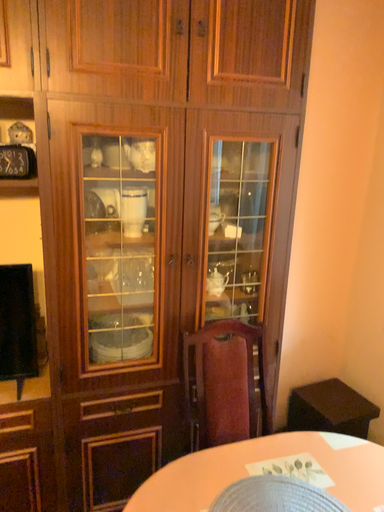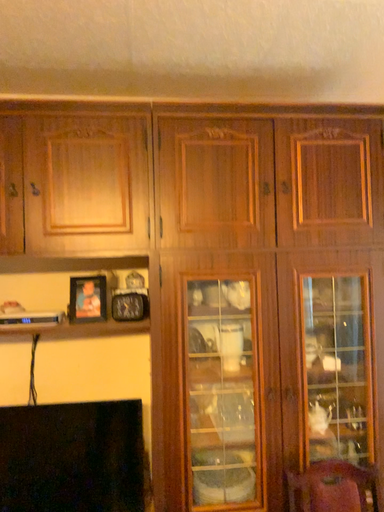
Question: How did the camera likely rotate when shooting the video?

Choices:
 (A) rotated downward
 (B) rotated upward

Answer: (B)